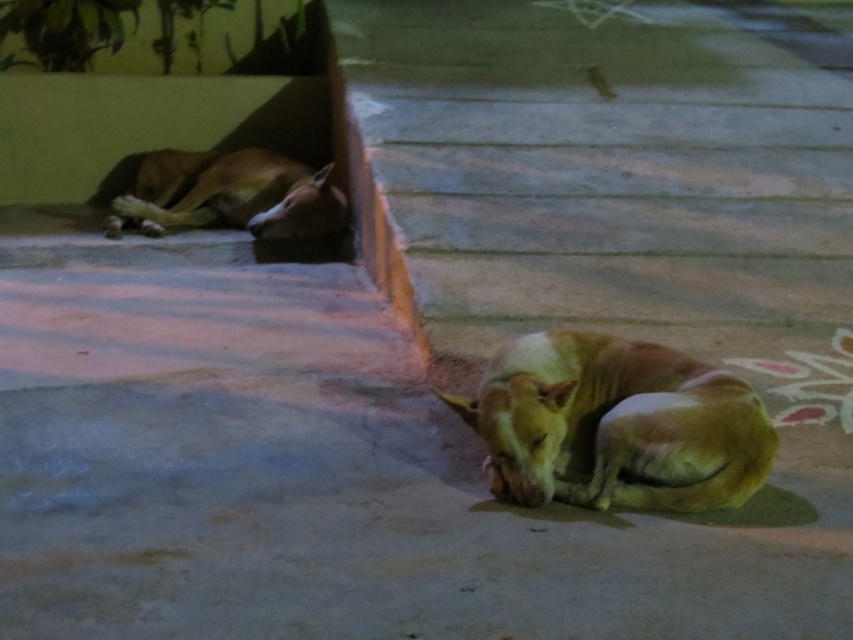
Can you confirm if gray concrete pavement at center is positioned to the left of brown furry dog at upper left?

No, gray concrete pavement at center is not to the left of brown furry dog at upper left.

Is point (248, 589) positioned in front of point (202, 186)?

Yes, it is.

Where is `gray concrete pavement at center`? gray concrete pavement at center is located at coordinates (322, 474).

Is gray concrete pavement at center positioned at the back of golden fur dog at lower right?

No, gray concrete pavement at center is closer to the viewer.

Who is higher up, gray concrete pavement at center or golden fur dog at lower right?

gray concrete pavement at center is higher up.

Who is more forward, (233, 468) or (728, 448)?

Positioned in front is point (728, 448).

This screenshot has height=640, width=853. Find the location of `gray concrete pavement at center`. gray concrete pavement at center is located at coordinates (322, 474).

Looking at this image, can you confirm if golden fur dog at lower right is bigger than brown furry dog at upper left?

Actually, golden fur dog at lower right might be smaller than brown furry dog at upper left.

Between point (695, 420) and point (241, 161), which one is positioned in front?

Positioned in front is point (695, 420).

The height and width of the screenshot is (640, 853). What do you see at coordinates (616, 426) in the screenshot?
I see `golden fur dog at lower right` at bounding box center [616, 426].

The height and width of the screenshot is (640, 853). I want to click on golden fur dog at lower right, so click(616, 426).